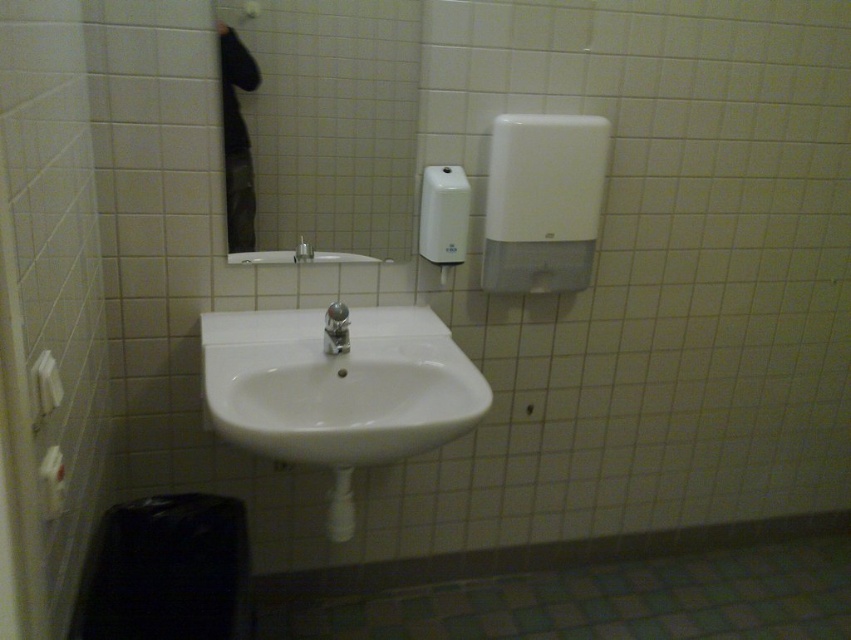
You are designing a bathroom layout and need to ensure that the white glossy sink at center and the matte silver faucet at center will fit within a 1.2 meter wide space. Given their widths, will both items fit side by side?

The white glossy sink at center is wider than the matte silver faucet at center. However, since the sink is already at the center and the faucet is part of it, they are likely designed to fit together within the available space. Therefore, they should fit within the 1.2 meter width as intended.

You are trying to determine which object is taller between the white plastic hand dryer at upper right and the satin chrome faucet at center. Based on the scene, which one is taller?

The white plastic hand dryer at upper right is taller than the satin chrome faucet at center.

You are standing in the bathroom and want to place a small plant between the two points, point 1 at [357,433] and point 2 at [301,256]. According to the bathroom layout, which point should the plant be closer to?

The plant should be placed closer to point 1 at [357,433] because it is in front of point 2 at [301,256], so the space between them allows the plant to be positioned nearer to the front point.